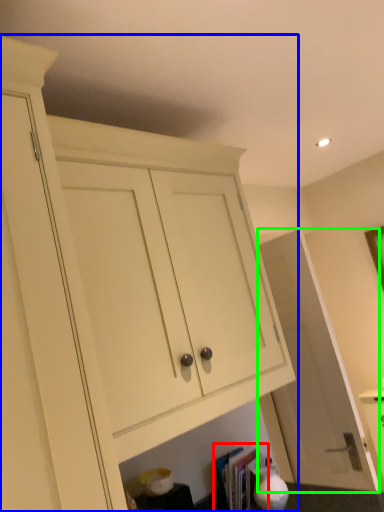
Question: Based on their relative distances, which object is farther from book (highlighted by a red box)? Choose from cabinetry (highlighted by a blue box) and door (highlighted by a green box).

Choices:
 (A) cabinetry
 (B) door

Answer: (A)